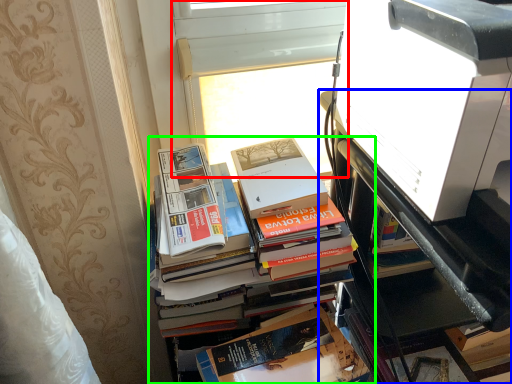
Question: Which object is the closest to the window screen (highlighted by a red box)? Choose among these: bookcase (highlighted by a blue box) or book (highlighted by a green box).

Choices:
 (A) bookcase
 (B) book

Answer: (B)